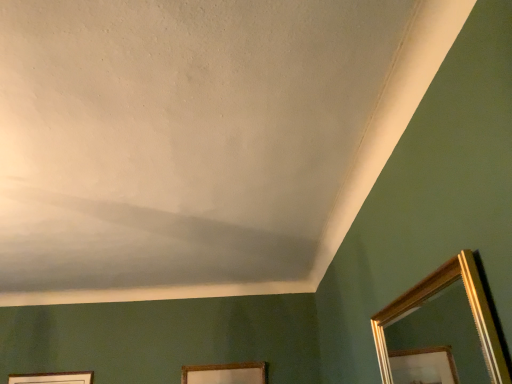
Question: Looking at their shapes, would you say gold wooden picture frame at lower center is wider or thinner than gold-framed mirror at lower right?

Choices:
 (A) thin
 (B) wide

Answer: (A)

Question: Is point (257, 362) positioned closer to the camera than point (437, 321)?

Choices:
 (A) farther
 (B) closer

Answer: (B)

Question: Would you say gold wooden picture frame at lower center is inside or outside gold-framed mirror at lower right?

Choices:
 (A) inside
 (B) outside

Answer: (B)

Question: From the image's perspective, is gold-framed mirror at lower right positioned above or below gold wooden picture frame at lower center?

Choices:
 (A) above
 (B) below

Answer: (A)

Question: From a real-world perspective, relative to gold wooden picture frame at lower center, is gold-framed mirror at lower right vertically above or below?

Choices:
 (A) above
 (B) below

Answer: (B)

Question: In terms of width, does gold-framed mirror at lower right look wider or thinner when compared to gold wooden picture frame at lower center?

Choices:
 (A) thin
 (B) wide

Answer: (B)

Question: In terms of height, does gold-framed mirror at lower right look taller or shorter compared to gold wooden picture frame at lower center?

Choices:
 (A) tall
 (B) short

Answer: (A)